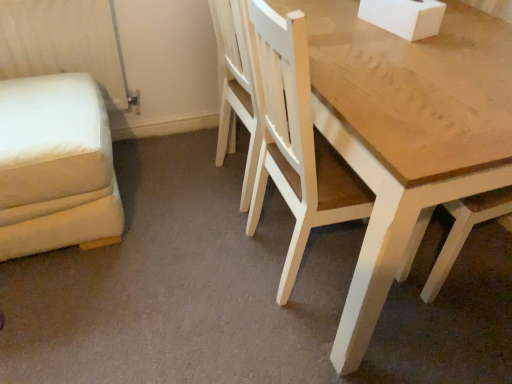
Locate an element on the screen. This screenshot has height=384, width=512. vacant area that is situated to the right of white fabric swivel chair at left is located at coordinates (168, 218).